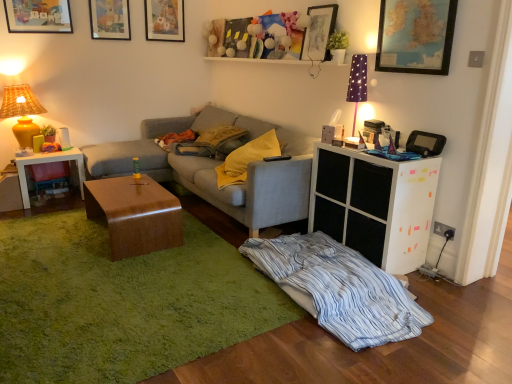
Question: From a real-world perspective, is matte wooden picture frame at upper left, marked as the 3th picture frame in a back-to-front arrangement, under matte wooden picture frame at upper center, placed as the 3th picture frame when sorted from right to left?

Choices:
 (A) no
 (B) yes

Answer: (B)

Question: From a real-world perspective, is matte wooden picture frame at upper left, the first picture frame positioned from the left, located higher than matte wooden picture frame at upper center, the 1th picture frame from the back?

Choices:
 (A) yes
 (B) no

Answer: (B)

Question: Would you say matte wooden picture frame at upper center, arranged as the third picture frame when viewed from the left, is part of matte wooden picture frame at upper left, the fifth picture frame when ordered from right to left,'s contents?

Choices:
 (A) yes
 (B) no

Answer: (B)

Question: Is matte wooden picture frame at upper left, marked as the third picture frame in a front-to-back arrangement, facing towards matte wooden picture frame at upper center, which is the 5th picture frame from front to back?

Choices:
 (A) no
 (B) yes

Answer: (A)

Question: Is matte wooden picture frame at upper left, marked as the third picture frame in a front-to-back arrangement, wider than matte wooden picture frame at upper center, the 1th picture frame from the back?

Choices:
 (A) yes
 (B) no

Answer: (A)

Question: From a real-world perspective, is white matte cabinet at right physically located above or below matte wooden picture frame at upper left, the first picture frame positioned from the left?

Choices:
 (A) above
 (B) below

Answer: (B)

Question: Based on their sizes in the image, would you say white matte cabinet at right is bigger or smaller than matte wooden picture frame at upper left, the fifth picture frame when ordered from right to left?

Choices:
 (A) small
 (B) big

Answer: (B)

Question: Is white matte cabinet at right taller or shorter than matte wooden picture frame at upper left, marked as the 3th picture frame in a back-to-front arrangement?

Choices:
 (A) short
 (B) tall

Answer: (B)

Question: Would you say white matte cabinet at right is to the left or to the right of matte wooden picture frame at upper left, marked as the 3th picture frame in a back-to-front arrangement, in the picture?

Choices:
 (A) left
 (B) right

Answer: (B)

Question: From a real-world perspective, is matte wooden picture frame at upper center, arranged as the third picture frame when viewed from the left, above or below purple fabric lampshade at upper right, which appears as the 2th table lamp when viewed from the left?

Choices:
 (A) below
 (B) above

Answer: (B)

Question: Considering the positions of point (159, 8) and point (358, 56), is point (159, 8) closer or farther from the camera than point (358, 56)?

Choices:
 (A) closer
 (B) farther

Answer: (B)

Question: Looking at their shapes, would you say matte wooden picture frame at upper center, placed as the 3th picture frame when sorted from right to left, is wider or thinner than purple fabric lampshade at upper right, positioned as the second table lamp in back-to-front order?

Choices:
 (A) thin
 (B) wide

Answer: (A)

Question: In the image, is matte wooden picture frame at upper center, the 1th picture frame from the back, positioned in front of or behind purple fabric lampshade at upper right, which is counted as the first table lamp, starting from the front?

Choices:
 (A) front
 (B) behind

Answer: (B)

Question: Relative to matte wooden picture frame at upper left, marked as the third picture frame in a front-to-back arrangement, is wooden picture frame at upper center, placed as the fourth picture frame when sorted from left to right, in front or behind?

Choices:
 (A) front
 (B) behind

Answer: (A)

Question: From a real-world perspective, is wooden picture frame at upper center, the 2th picture frame positioned from the right, physically located above or below matte wooden picture frame at upper left, marked as the 3th picture frame in a back-to-front arrangement?

Choices:
 (A) above
 (B) below

Answer: (B)